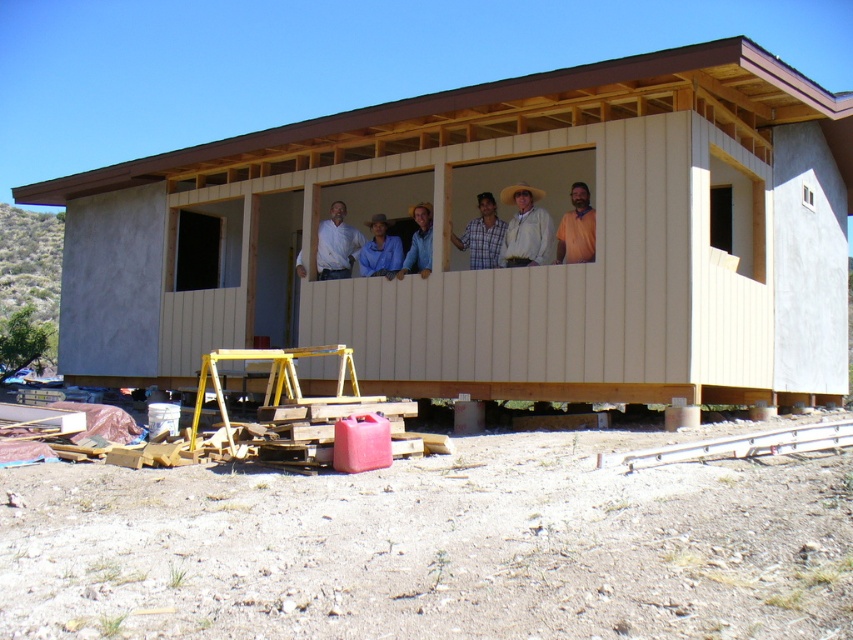
You are standing outside the beige wood cabin at center and looking towards the brown shirt at center. Which object is higher in elevation?

The brown shirt at center is higher than the beige wood cabin at center because the beige wood cabin at center is below the brown shirt at center.

You are a photographer standing outside the beige wood cabin at center and brown shirt at center. You want to take a photo that includes both objects in the frame. Which object should you position closer to the camera to ensure both fit in the frame?

The beige wood cabin at center is wider than the brown shirt at center, so you should position the brown shirt at center closer to the camera to ensure both fit in the frame.